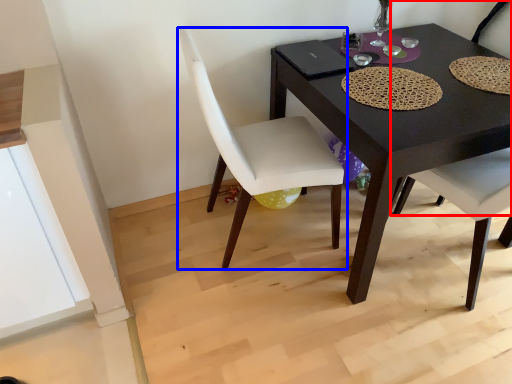
Question: Which object appears farthest to the camera in this image, chair (highlighted by a red box) or chair (highlighted by a blue box)?

Choices:
 (A) chair
 (B) chair

Answer: (A)